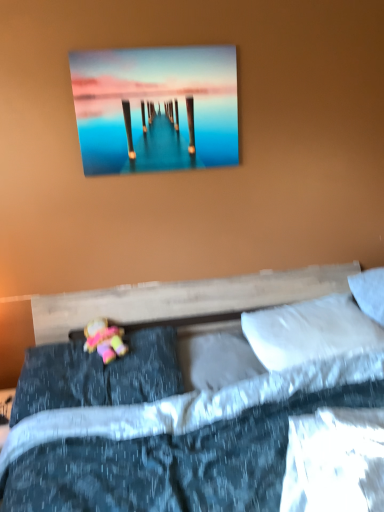
Question: Relative to metallic glossy pier at upper center, is pastel fabric doll at lower left in front or behind?

Choices:
 (A) front
 (B) behind

Answer: (A)

Question: Considering the positions of pastel fabric doll at lower left and metallic glossy pier at upper center in the image, is pastel fabric doll at lower left bigger or smaller than metallic glossy pier at upper center?

Choices:
 (A) big
 (B) small

Answer: (B)

Question: Which of these objects is positioned farthest from the white soft pillow at center, which is the second pillow in left-to-right order?

Choices:
 (A) white soft pillow at right, marked as the 1th pillow in a right-to-left arrangement
 (B) white soft pillow at upper right, which ranks as the 3th pillow in left-to-right order
 (C) dark blue textured pillow at lower left, the 1th pillow in the left-to-right sequence
 (D) metallic glossy pier at upper center
 (E) pastel fabric doll at lower left

Answer: (D)

Question: Which object is positioned farthest from the metallic glossy pier at upper center?

Choices:
 (A) white soft pillow at upper right, marked as the second pillow in a right-to-left arrangement
 (B) white soft pillow at right, marked as the 1th pillow in a right-to-left arrangement
 (C) pastel fabric doll at lower left
 (D) white soft pillow at center, marked as the 3th pillow in a right-to-left arrangement
 (E) dark blue textured pillow at lower left, placed as the 4th pillow when sorted from right to left

Answer: (B)